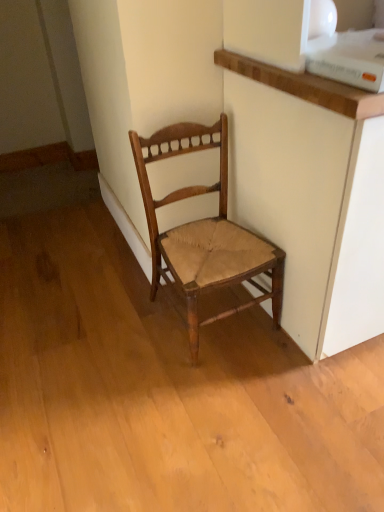
Question: Is point (354, 116) positioned closer to the camera than point (249, 242)?

Choices:
 (A) closer
 (B) farther

Answer: (A)

Question: From the image's perspective, is matte white cabinet at upper right above or below wooden woven seat chair at center?

Choices:
 (A) below
 (B) above

Answer: (B)

Question: Looking at their shapes, would you say matte white cabinet at upper right is wider or thinner than wooden woven seat chair at center?

Choices:
 (A) thin
 (B) wide

Answer: (B)

Question: Does point (210, 245) appear closer or farther from the camera than point (291, 330)?

Choices:
 (A) farther
 (B) closer

Answer: (B)

Question: Looking at the image, does wooden woven seat chair at center seem bigger or smaller compared to matte white cabinet at upper right?

Choices:
 (A) big
 (B) small

Answer: (B)

Question: Considering the relative positions of wooden woven seat chair at center and matte white cabinet at upper right in the image provided, is wooden woven seat chair at center to the left or to the right of matte white cabinet at upper right?

Choices:
 (A) left
 (B) right

Answer: (A)

Question: Looking at their shapes, would you say wooden woven seat chair at center is wider or thinner than matte white cabinet at upper right?

Choices:
 (A) thin
 (B) wide

Answer: (A)